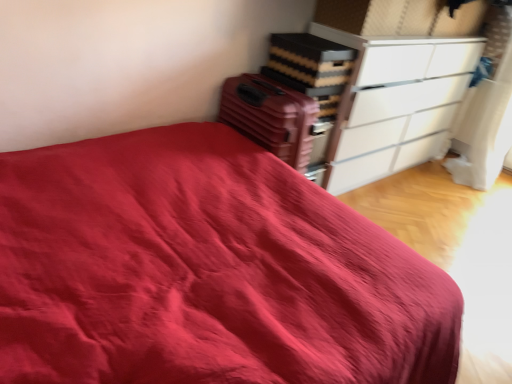
Question: Considering their positions, is white glossy chest of drawers at upper right located in front of or behind matte plastic suitcase at center-right?

Choices:
 (A) behind
 (B) front

Answer: (A)

Question: From the image's perspective, is white glossy chest of drawers at upper right located above or below matte plastic suitcase at center-right?

Choices:
 (A) above
 (B) below

Answer: (A)

Question: From a real-world perspective, is white glossy chest of drawers at upper right above or below matte plastic suitcase at center-right?

Choices:
 (A) above
 (B) below

Answer: (B)

Question: In terms of height, does matte plastic suitcase at center-right look taller or shorter compared to white glossy chest of drawers at upper right?

Choices:
 (A) tall
 (B) short

Answer: (B)

Question: Is point (257, 130) closer or farther from the camera than point (359, 89)?

Choices:
 (A) closer
 (B) farther

Answer: (A)

Question: From the image's perspective, is matte plastic suitcase at center-right located above or below white glossy chest of drawers at upper right?

Choices:
 (A) below
 (B) above

Answer: (A)

Question: Choose the correct answer: Is matte plastic suitcase at center-right inside white glossy chest of drawers at upper right or outside it?

Choices:
 (A) inside
 (B) outside

Answer: (B)